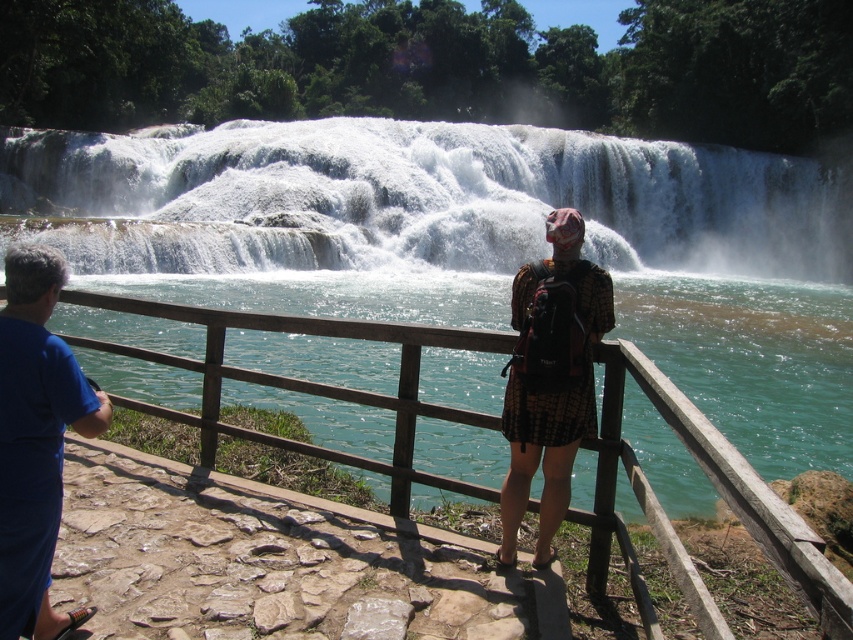
From the picture: You are a photographer planning to take a photo of the white frothy water at center and the blue fabric shirt at lower left. Based on the scene description, which object appears bigger in the photo?

The white frothy water at center appears bigger in the photo because it has a larger size compared to the blue fabric shirt at lower left.

You are standing at the point closer to the camera between point (265, 234) and point (321, 385). Which point are you at?

You are at point (265, 234) because it is closer to the camera than point (321, 385).